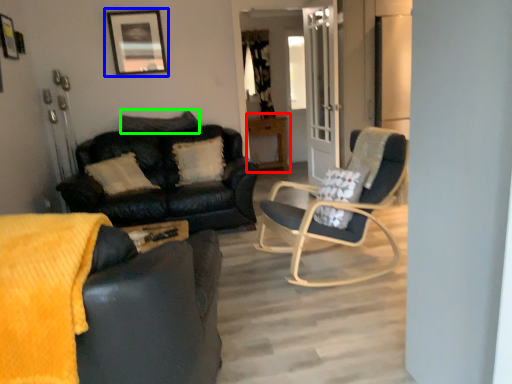
Question: Based on their relative distances, which object is nearer to table (highlighted by a red box)? Choose from picture frame (highlighted by a blue box) and pillow (highlighted by a green box).

Choices:
 (A) picture frame
 (B) pillow

Answer: (B)